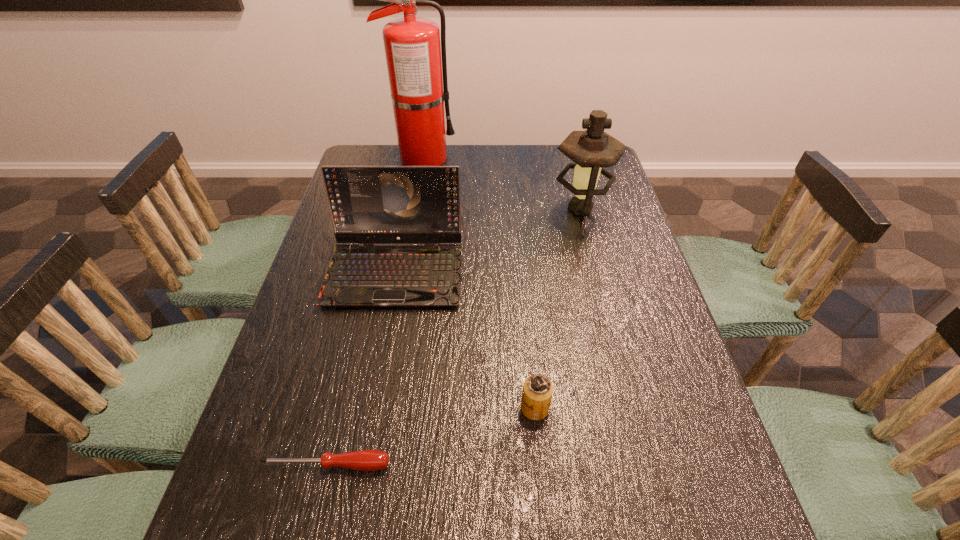
Where is `vacant point located between the laptop computer and the screwdriver`? vacant point located between the laptop computer and the screwdriver is located at coordinates (361, 368).

At what (x,y) coordinates should I click in order to perform the action: click on free space between the nearest object and the third nearest object. Please return your answer as a coordinate pair (x, y). Looking at the image, I should click on (361, 368).

At what (x,y) coordinates should I click in order to perform the action: click on free space between the screwdriver and the fire extinguisher. Please return your answer as a coordinate pair (x, y). The width and height of the screenshot is (960, 540). Looking at the image, I should click on (374, 311).

The image size is (960, 540). Identify the location of free space that is in between the shortest object and the tallest object. (374, 311).

Where is `free space between the nearest object and the third tallest object`? free space between the nearest object and the third tallest object is located at coordinates (361, 368).

Choose which object is the nearest neighbor to the screwdriver. Please provide its 2D coordinates. Your answer should be formatted as a tuple, i.e. [(x, y)], where the tuple contains the x and y coordinates of a point satisfying the conditions above.

[(537, 393)]

Point out which object is positioned as the third nearest to the shortest object. Please provide its 2D coordinates. Your answer should be formatted as a tuple, i.e. [(x, y)], where the tuple contains the x and y coordinates of a point satisfying the conditions above.

[(592, 150)]

Where is `vacant point that satisfies the following two spatial constraints: 1. at the nozzle of the farthest object; 2. on the screen of the third nearest object`? vacant point that satisfies the following two spatial constraints: 1. at the nozzle of the farthest object; 2. on the screen of the third nearest object is located at coordinates (403, 271).

Find the location of a particular element. Image resolution: width=960 pixels, height=540 pixels. vacant area that satisfies the following two spatial constraints: 1. at the nozzle of the rightmost object; 2. on the left side of the tallest object is located at coordinates (414, 208).

The image size is (960, 540). Identify the location of free region that satisfies the following two spatial constraints: 1. on the screen of the third tallest object; 2. on the left side of the second nearest object. tap(370, 408).